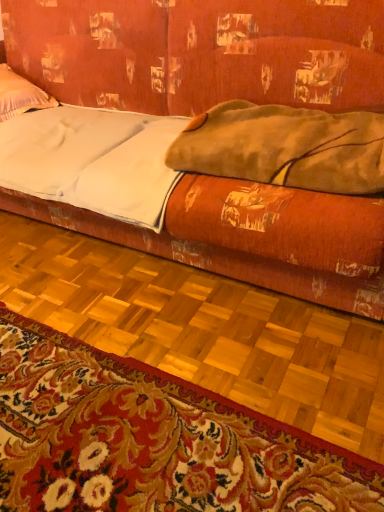
Question: Are white matte sheet at center and white soft pillow at upper left located far from each other?

Choices:
 (A) no
 (B) yes

Answer: (A)

Question: Is white matte sheet at center in contact with white soft pillow at upper left?

Choices:
 (A) no
 (B) yes

Answer: (A)

Question: Can you confirm if white matte sheet at center is positioned to the right of white soft pillow at upper left?

Choices:
 (A) yes
 (B) no

Answer: (A)

Question: Can you confirm if white matte sheet at center is positioned to the left of white soft pillow at upper left?

Choices:
 (A) no
 (B) yes

Answer: (A)

Question: From the image's perspective, is white matte sheet at center over white soft pillow at upper left?

Choices:
 (A) yes
 (B) no

Answer: (B)

Question: Considering the positions of point (120, 177) and point (360, 146), is point (120, 177) closer or farther from the camera than point (360, 146)?

Choices:
 (A) closer
 (B) farther

Answer: (B)

Question: Based on their positions, is white matte sheet at center located to the left or right of fuzzy brown blanket at upper right?

Choices:
 (A) left
 (B) right

Answer: (A)

Question: Is white matte sheet at center bigger or smaller than fuzzy brown blanket at upper right?

Choices:
 (A) big
 (B) small

Answer: (A)

Question: From a real-world perspective, is white matte sheet at center physically located above or below fuzzy brown blanket at upper right?

Choices:
 (A) above
 (B) below

Answer: (B)

Question: Is point (362, 509) positioned closer to the camera than point (66, 164)?

Choices:
 (A) farther
 (B) closer

Answer: (B)

Question: Considering the positions of carpeted mat at lower center and white matte sheet at center in the image, is carpeted mat at lower center taller or shorter than white matte sheet at center?

Choices:
 (A) short
 (B) tall

Answer: (A)

Question: In terms of size, does carpeted mat at lower center appear bigger or smaller than white matte sheet at center?

Choices:
 (A) big
 (B) small

Answer: (B)

Question: From a real-world perspective, is carpeted mat at lower center physically located above or below white matte sheet at center?

Choices:
 (A) above
 (B) below

Answer: (B)

Question: From a real-world perspective, is carpeted mat at lower center above or below velvet orange couch at center?

Choices:
 (A) below
 (B) above

Answer: (A)

Question: Is carpeted mat at lower center bigger or smaller than velvet orange couch at center?

Choices:
 (A) small
 (B) big

Answer: (A)